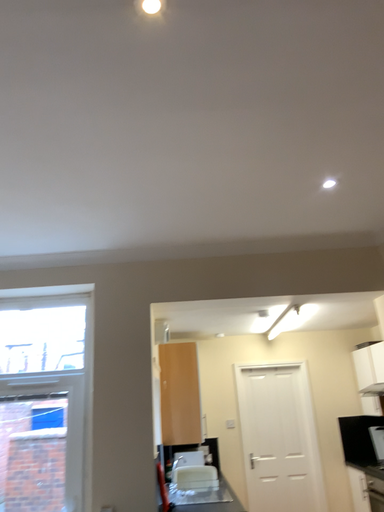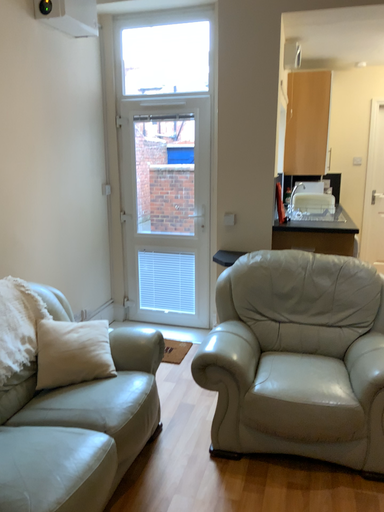
Question: How did the camera likely rotate when shooting the video?

Choices:
 (A) rotated upward
 (B) rotated downward

Answer: (B)